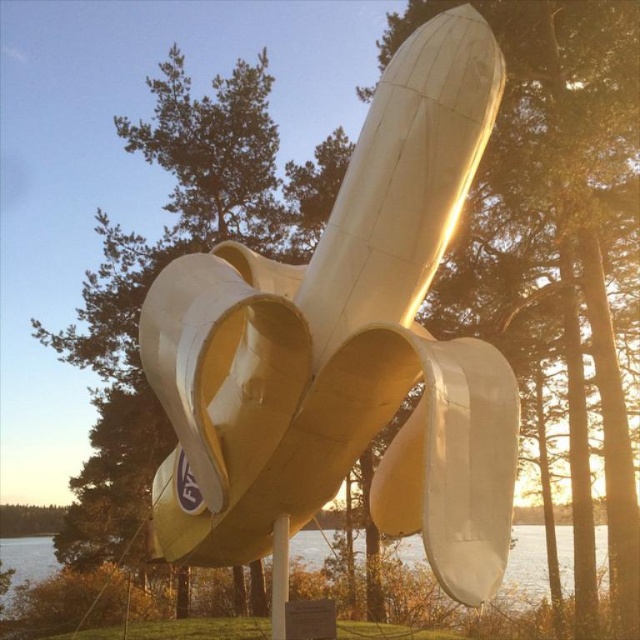
Does gold metallic sculpture at center have a lesser height compared to matte white sculpture at upper center?

Incorrect, gold metallic sculpture at center's height does not fall short of matte white sculpture at upper center's.

Locate an element on the screen. This screenshot has width=640, height=640. gold metallic sculpture at center is located at coordinates click(x=346, y=349).

Describe the element at coordinates (346, 349) in the screenshot. I see `gold metallic sculpture at center` at that location.

Does point (464, 426) come behind point (99, 440)?

No, (464, 426) is in front of (99, 440).

Identify the location of gold metallic sculpture at center. (346, 349).

Describe the element at coordinates (563, 212) in the screenshot. Image resolution: width=640 pixels, height=640 pixels. I see `matte white sculpture at upper center` at that location.

Between matte white sculpture at upper center and green leafy tree at center, which one appears on the right side from the viewer's perspective?

From the viewer's perspective, matte white sculpture at upper center appears more on the right side.

Between point (586, 141) and point (305, 243), which one is positioned behind?

Point (305, 243)

Find the location of a particular element. matte white sculpture at upper center is located at coordinates (563, 212).